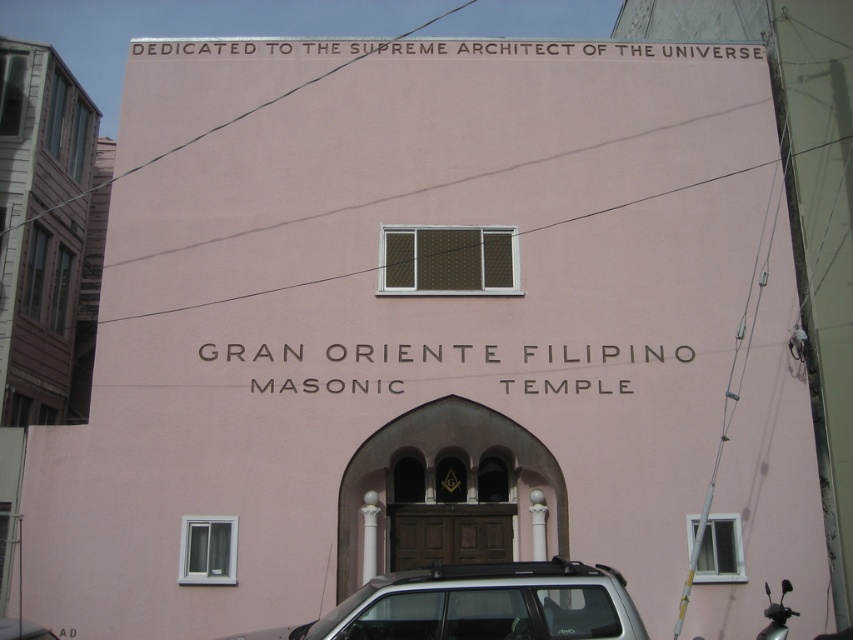
Question: Is silver metallic suv at lower center wider than metallic silver motorcycle at lower right?

Choices:
 (A) yes
 (B) no

Answer: (A)

Question: Can you confirm if silver metallic suv at lower center is positioned below metallic silver motorcycle at lower right?

Choices:
 (A) no
 (B) yes

Answer: (A)

Question: Which of the following is the farthest from the observer?

Choices:
 (A) silver metallic suv at lower center
 (B) metallic silver motorcycle at lower right

Answer: (B)

Question: Which object appears farthest from the camera in this image?

Choices:
 (A) metallic silver motorcycle at lower right
 (B) silver metallic suv at lower center

Answer: (A)

Question: Does silver metallic suv at lower center appear on the left side of metallic silver motorcycle at lower right?

Choices:
 (A) no
 (B) yes

Answer: (B)